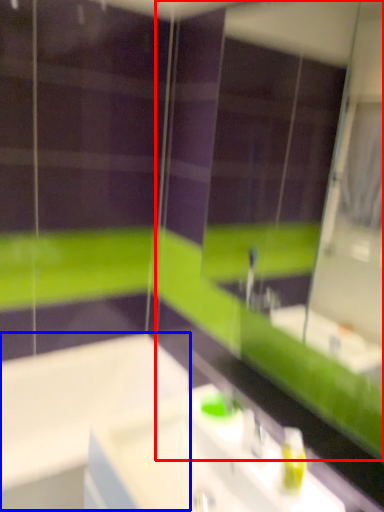
Question: Which object is closer to the camera taking this photo, mirror (highlighted by a red box) or bath (highlighted by a blue box)?

Choices:
 (A) mirror
 (B) bath

Answer: (A)